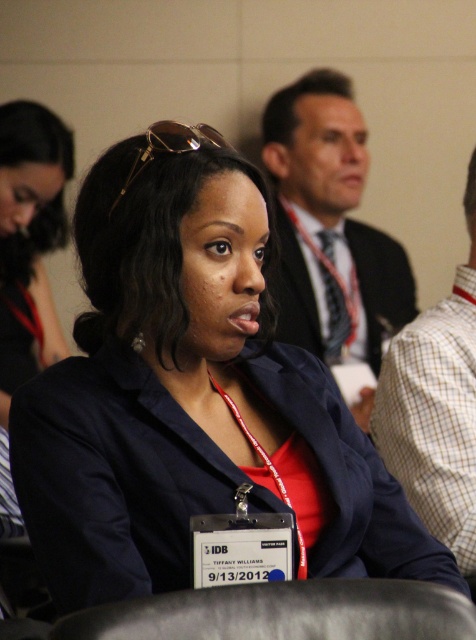
Locate an element on the screen. white checkered shirt at right is located at coordinates (436, 406).

Who is positioned more to the right, white checkered shirt at right or dark gray leather chair at lower center?

From the viewer's perspective, white checkered shirt at right appears more on the right side.

Is point (448, 497) behind point (396, 616)?

Yes, point (448, 497) is behind point (396, 616).

Identify the location of white checkered shirt at right. The width and height of the screenshot is (476, 640). (436, 406).

Does dark suit jacket at upper center appear on the left side of white checkered shirt at right?

Yes, dark suit jacket at upper center is to the left of white checkered shirt at right.

Is dark suit jacket at upper center in front of white checkered shirt at right?

That is False.

You are a GUI agent. You are given a task and a screenshot of the screen. Output one action in this format:
    pyautogui.click(x=<x>, y=<y>)
    Task: Click on the dark suit jacket at upper center
    Image resolution: width=476 pixels, height=640 pixels.
    Given the screenshot: What is the action you would take?
    pyautogui.click(x=329, y=227)

Is point (327, 129) positioned behind point (297, 616)?

Yes, point (327, 129) is farther from viewer.

This screenshot has width=476, height=640. Find the location of `dark suit jacket at upper center`. dark suit jacket at upper center is located at coordinates (329, 227).

Image resolution: width=476 pixels, height=640 pixels. I want to click on dark suit jacket at upper center, so click(x=329, y=227).

Find the location of a particular element. This screenshot has width=476, height=640. dark suit jacket at upper center is located at coordinates (329, 227).